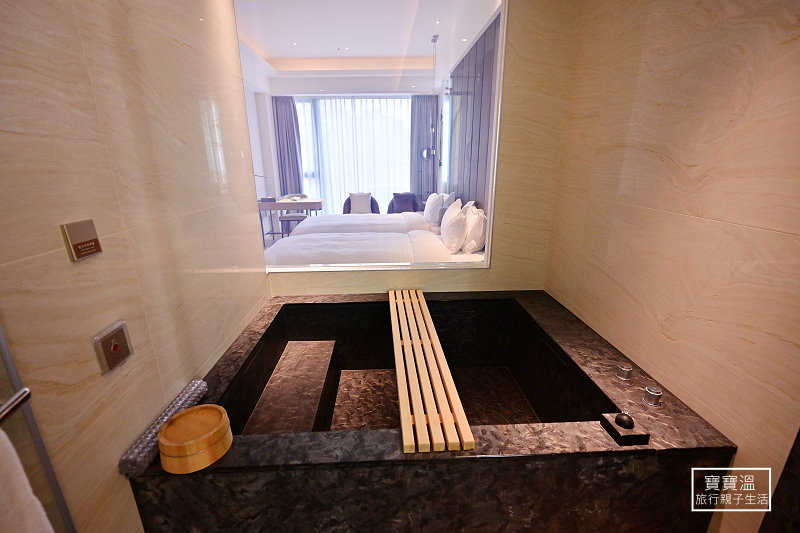
This screenshot has height=533, width=800. What are the coordinates of `dark marble bathtub` in the screenshot? It's located at (537, 445).